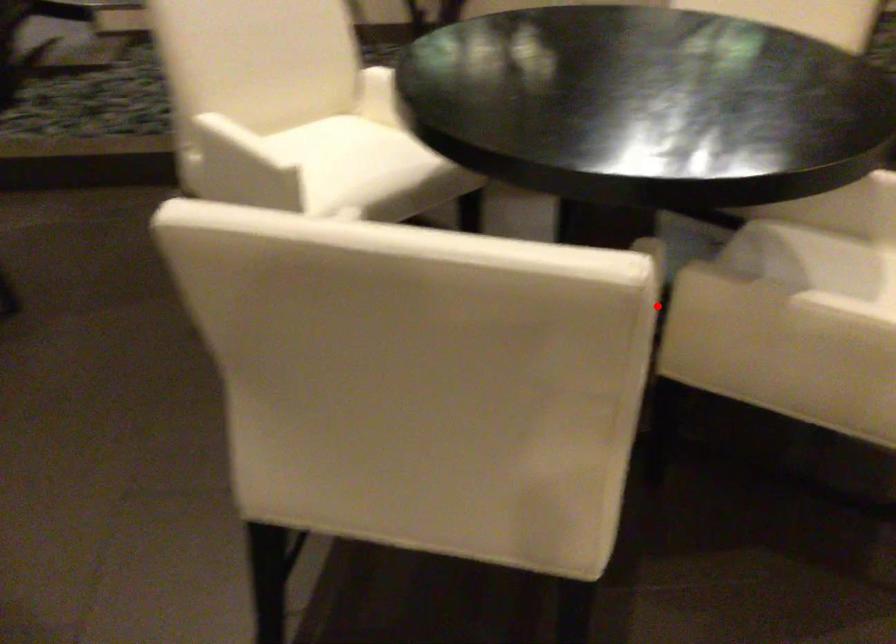
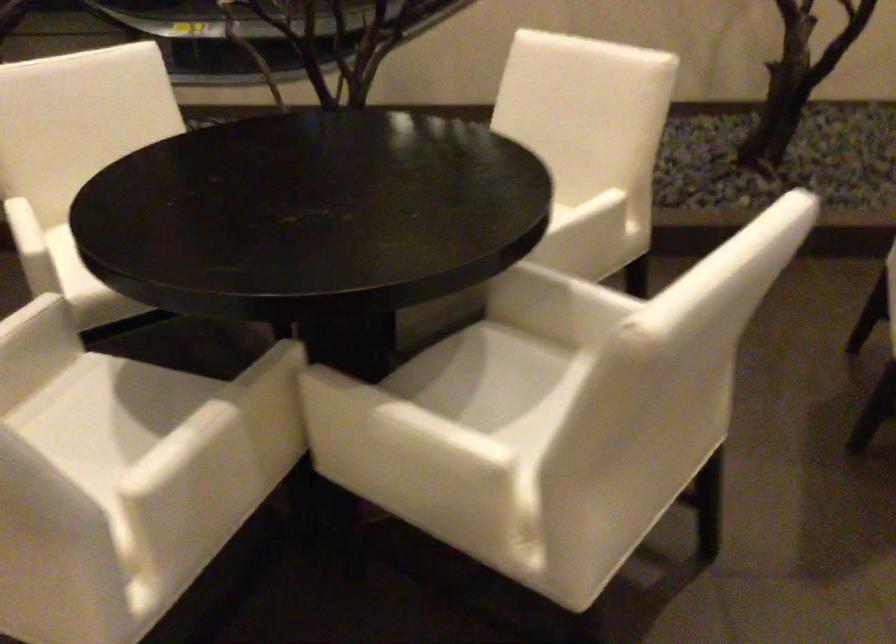
Locate, in the second image, the point that corresponds to the highlighted location in the first image.

(271, 408)